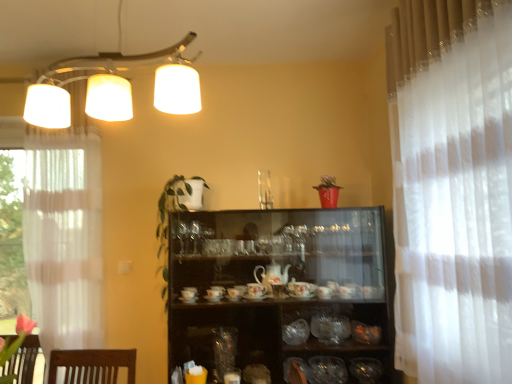
Question: From a real-world perspective, is shiny metallic bowl at lower right, which ranks as the fourth tableware in left-to-right order, on translucent glass bowls at center, which is the third tableware from left to right?

Choices:
 (A) yes
 (B) no

Answer: (B)

Question: Does shiny metallic bowl at lower right, which ranks as the 2th tableware in right-to-left order, have a lesser height compared to translucent glass bowls at center, the third tableware from the right?

Choices:
 (A) yes
 (B) no

Answer: (A)

Question: Is shiny metallic bowl at lower right, which ranks as the fourth tableware in left-to-right order, wider than translucent glass bowls at center, which is the third tableware from left to right?

Choices:
 (A) yes
 (B) no

Answer: (B)

Question: Considering the relative sizes of shiny metallic bowl at lower right, which ranks as the fourth tableware in left-to-right order, and translucent glass bowls at center, the third tableware from the right, in the image provided, is shiny metallic bowl at lower right, which ranks as the fourth tableware in left-to-right order, taller than translucent glass bowls at center, the third tableware from the right,?

Choices:
 (A) yes
 (B) no

Answer: (B)

Question: Is shiny metallic bowl at lower right, which ranks as the 2th tableware in right-to-left order, not within translucent glass bowls at center, which is the third tableware from left to right?

Choices:
 (A) no
 (B) yes

Answer: (B)

Question: Would you say shiny metallic bowl at lower right, which ranks as the fourth tableware in left-to-right order, is to the left or to the right of green leafy plant at center in the picture?

Choices:
 (A) left
 (B) right

Answer: (B)

Question: From a real-world perspective, is shiny metallic bowl at lower right, which ranks as the 2th tableware in right-to-left order, positioned above or below green leafy plant at center?

Choices:
 (A) below
 (B) above

Answer: (A)

Question: From the image's perspective, is shiny metallic bowl at lower right, which ranks as the 2th tableware in right-to-left order, located above or below green leafy plant at center?

Choices:
 (A) above
 (B) below

Answer: (B)

Question: In the image, is shiny metallic bowl at lower right, which ranks as the fourth tableware in left-to-right order, positioned in front of or behind green leafy plant at center?

Choices:
 (A) behind
 (B) front

Answer: (A)

Question: Is translucent glass bowl at lower right, the 5th tableware from the left, to the left or to the right of white sheer curtain at right in the image?

Choices:
 (A) right
 (B) left

Answer: (B)

Question: Considering the positions of point (352, 319) and point (497, 155), is point (352, 319) closer or farther from the camera than point (497, 155)?

Choices:
 (A) farther
 (B) closer

Answer: (A)

Question: Based on their sizes in the image, would you say translucent glass bowl at lower right, the 5th tableware from the left, is bigger or smaller than white sheer curtain at right?

Choices:
 (A) big
 (B) small

Answer: (B)

Question: In the image, is translucent glass bowl at lower right, marked as the first tableware in a right-to-left arrangement, positioned in front of or behind white sheer curtain at right?

Choices:
 (A) behind
 (B) front

Answer: (A)

Question: In the image, is white sheer curtain at right positioned in front of or behind transparent glass vase at center, the fifth tableware in the right-to-left sequence?

Choices:
 (A) behind
 (B) front

Answer: (B)

Question: In terms of width, does white sheer curtain at right look wider or thinner when compared to transparent glass vase at center, the fifth tableware in the right-to-left sequence?

Choices:
 (A) wide
 (B) thin

Answer: (B)